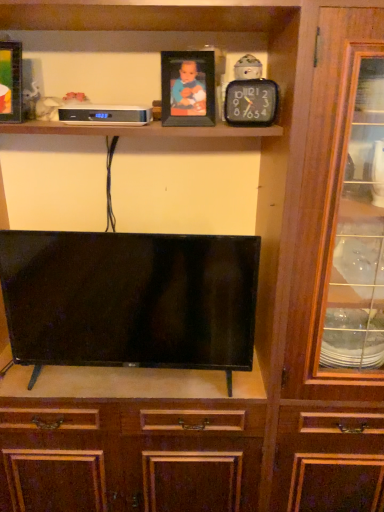
This screenshot has height=512, width=384. What do you see at coordinates (105, 115) in the screenshot?
I see `white plastic clock at upper center` at bounding box center [105, 115].

I want to click on white plastic clock at upper center, so [x=105, y=115].

The width and height of the screenshot is (384, 512). Identify the location of black plastic clock at upper center. (251, 103).

This screenshot has height=512, width=384. I want to click on wooden photo frame at upper center, the second picture frame from the left, so click(x=188, y=89).

The image size is (384, 512). In order to click on white plastic clock at upper center in this screenshot , I will do `click(105, 115)`.

Is matte black picture frame at upper left, which is counted as the 1th picture frame, starting from the left, oriented away from black plastic clock at upper center?

No, matte black picture frame at upper left, which is counted as the 1th picture frame, starting from the left, is not facing away from black plastic clock at upper center.

Is matte black picture frame at upper left, positioned as the 2th picture frame in right-to-left order, bigger or smaller than black plastic clock at upper center?

Clearly, matte black picture frame at upper left, positioned as the 2th picture frame in right-to-left order, is larger in size than black plastic clock at upper center.

From a real-world perspective, is matte black picture frame at upper left, positioned as the 2th picture frame in right-to-left order, above or below black plastic clock at upper center?

From a real-world perspective, matte black picture frame at upper left, positioned as the 2th picture frame in right-to-left order, is physically above black plastic clock at upper center.

From the image's perspective, between wooden photo frame at upper center, the second picture frame from the left, and white plastic clock at upper center, which one is located above?

wooden photo frame at upper center, the second picture frame from the left.

From a real-world perspective, who is located lower, wooden photo frame at upper center, which is counted as the first picture frame, starting from the right, or white plastic clock at upper center?

In real-world perspective, white plastic clock at upper center is lower.

Measure the distance from wooden photo frame at upper center, which is counted as the first picture frame, starting from the right, to white plastic clock at upper center.

wooden photo frame at upper center, which is counted as the first picture frame, starting from the right, and white plastic clock at upper center are 15.04 centimeters apart.

Can you confirm if wooden photo frame at upper center, the second picture frame from the left, is smaller than white plastic clock at upper center?

Incorrect, wooden photo frame at upper center, the second picture frame from the left, is not smaller in size than white plastic clock at upper center.

Is white plastic clock at upper center further to camera compared to matte black picture frame at upper left, which is counted as the 1th picture frame, starting from the left?

Yes, it is.

Considering the sizes of objects white plastic clock at upper center and matte black picture frame at upper left, which is counted as the 1th picture frame, starting from the left, in the image provided, who is smaller, white plastic clock at upper center or matte black picture frame at upper left, which is counted as the 1th picture frame, starting from the left,?

white plastic clock at upper center.

Can you tell me how much white plastic clock at upper center and matte black picture frame at upper left, which is counted as the 1th picture frame, starting from the left, differ in facing direction?

white plastic clock at upper center and matte black picture frame at upper left, which is counted as the 1th picture frame, starting from the left, are facing 6.68 degrees away from each other.

Based on the photo, can you confirm if matte black picture frame at upper left, which is counted as the 1th picture frame, starting from the left, is bigger than wooden photo frame at upper center, which is counted as the first picture frame, starting from the right?

Yes, matte black picture frame at upper left, which is counted as the 1th picture frame, starting from the left, is bigger than wooden photo frame at upper center, which is counted as the first picture frame, starting from the right.

Considering the relative sizes of matte black picture frame at upper left, positioned as the 2th picture frame in right-to-left order, and wooden photo frame at upper center, the second picture frame from the left, in the image provided, is matte black picture frame at upper left, positioned as the 2th picture frame in right-to-left order, wider than wooden photo frame at upper center, the second picture frame from the left,?

Correct, the width of matte black picture frame at upper left, positioned as the 2th picture frame in right-to-left order, exceeds that of wooden photo frame at upper center, the second picture frame from the left.

Is matte black picture frame at upper left, which is counted as the 1th picture frame, starting from the left, not close to wooden photo frame at upper center, the second picture frame from the left?

No, matte black picture frame at upper left, which is counted as the 1th picture frame, starting from the left, is in close proximity to wooden photo frame at upper center, the second picture frame from the left.

Does black plastic clock at upper center touch matte black picture frame at upper left, which is counted as the 1th picture frame, starting from the left?

black plastic clock at upper center and matte black picture frame at upper left, which is counted as the 1th picture frame, starting from the left, are clearly separated.

Identify the location of picture frame that is the 2nd one above the black plastic clock at upper center (from a real-world perspective). The image size is (384, 512). (10, 81).

Which object is closer to the camera taking this photo, black plastic clock at upper center or matte black picture frame at upper left, which is counted as the 1th picture frame, starting from the left?

black plastic clock at upper center is in front.

How many degrees apart are the facing directions of black plastic clock at upper center and matte black picture frame at upper left, which is counted as the 1th picture frame, starting from the left?

The facing directions of black plastic clock at upper center and matte black picture frame at upper left, which is counted as the 1th picture frame, starting from the left, are 23.5 degrees apart.

Is black plastic clock at upper center completely or partially inside black glossy tv at center?

Definitely not — black plastic clock at upper center is not inside black glossy tv at center.

Considering the relative positions of black glossy tv at center and black plastic clock at upper center in the image provided, is black glossy tv at center to the left or to the right of black plastic clock at upper center?

In the image, black glossy tv at center appears on the left side of black plastic clock at upper center.

Which is in front, point (11, 314) or point (235, 113)?

The point (235, 113) is closer.

From a real-world perspective, is black glossy tv at center physically above black plastic clock at upper center?

No.

In terms of height, does black glossy tv at center look taller or shorter compared to wooden photo frame at upper center, which is counted as the first picture frame, starting from the right?

In the image, black glossy tv at center appears to be taller than wooden photo frame at upper center, which is counted as the first picture frame, starting from the right.

Is black glossy tv at center situated inside wooden photo frame at upper center, the second picture frame from the left, or outside?

black glossy tv at center is spatially situated outside wooden photo frame at upper center, the second picture frame from the left.

This screenshot has height=512, width=384. What are the coordinates of `television below the wooden photo frame at upper center, the second picture frame from the left (from a real-world perspective)` in the screenshot? It's located at (130, 298).

Is black glossy tv at center aimed at wooden photo frame at upper center, which is counted as the first picture frame, starting from the right?

No, black glossy tv at center is not oriented towards wooden photo frame at upper center, which is counted as the first picture frame, starting from the right.

Where is `clock on the right of the matte black picture frame at upper left, positioned as the 2th picture frame in right-to-left order`? Image resolution: width=384 pixels, height=512 pixels. clock on the right of the matte black picture frame at upper left, positioned as the 2th picture frame in right-to-left order is located at coordinates (251, 103).

I want to click on appliance that appears below the wooden photo frame at upper center, which is counted as the first picture frame, starting from the right (from the image's perspective), so click(x=105, y=115).

Based on their spatial positions, is wooden photo frame at upper center, which is counted as the first picture frame, starting from the right, or black glossy tv at center further from black plastic clock at upper center?

black glossy tv at center lies further to black plastic clock at upper center than the other object.

Based on their spatial positions, is black plastic clock at upper center or black glossy tv at center further from matte black picture frame at upper left, positioned as the 2th picture frame in right-to-left order?

Based on the image, black glossy tv at center appears to be further to matte black picture frame at upper left, positioned as the 2th picture frame in right-to-left order.

Estimate the real-world distances between objects in this image. Which object is further from white plastic clock at upper center, wooden photo frame at upper center, the second picture frame from the left, or matte black picture frame at upper left, which is counted as the 1th picture frame, starting from the left?

matte black picture frame at upper left, which is counted as the 1th picture frame, starting from the left, lies further to white plastic clock at upper center than the other object.

Considering their positions, is matte black picture frame at upper left, positioned as the 2th picture frame in right-to-left order, positioned closer to wooden photo frame at upper center, the second picture frame from the left, than white plastic clock at upper center?

white plastic clock at upper center is positioned closer to the anchor wooden photo frame at upper center, the second picture frame from the left.

Estimate the real-world distances between objects in this image. Which object is further from white plastic clock at upper center, black glossy tv at center or black plastic clock at upper center?

black glossy tv at center is positioned further to the anchor white plastic clock at upper center.

Which object lies nearer to the anchor point wooden photo frame at upper center, the second picture frame from the left, white plastic clock at upper center or black glossy tv at center?

Among the two, white plastic clock at upper center is located nearer to wooden photo frame at upper center, the second picture frame from the left.

Based on their spatial positions, is wooden photo frame at upper center, the second picture frame from the left, or black plastic clock at upper center further from white plastic clock at upper center?

black plastic clock at upper center lies further to white plastic clock at upper center than the other object.

When comparing their distances from wooden photo frame at upper center, which is counted as the first picture frame, starting from the right, does white plastic clock at upper center or matte black picture frame at upper left, positioned as the 2th picture frame in right-to-left order, seem further?

The object further to wooden photo frame at upper center, which is counted as the first picture frame, starting from the right, is matte black picture frame at upper left, positioned as the 2th picture frame in right-to-left order.

The width and height of the screenshot is (384, 512). In order to click on appliance between matte black picture frame at upper left, positioned as the 2th picture frame in right-to-left order, and wooden photo frame at upper center, the second picture frame from the left, from left to right in this screenshot , I will do `click(105, 115)`.

What are the coordinates of `clock between wooden photo frame at upper center, which is counted as the first picture frame, starting from the right, and black glossy tv at center from top to bottom` in the screenshot? It's located at (251, 103).

The image size is (384, 512). In order to click on picture frame between matte black picture frame at upper left, positioned as the 2th picture frame in right-to-left order, and black plastic clock at upper center from left to right in this screenshot , I will do `click(188, 89)`.

Where is `appliance between wooden photo frame at upper center, the second picture frame from the left, and black glossy tv at center in the up-down direction`? appliance between wooden photo frame at upper center, the second picture frame from the left, and black glossy tv at center in the up-down direction is located at coordinates (105, 115).